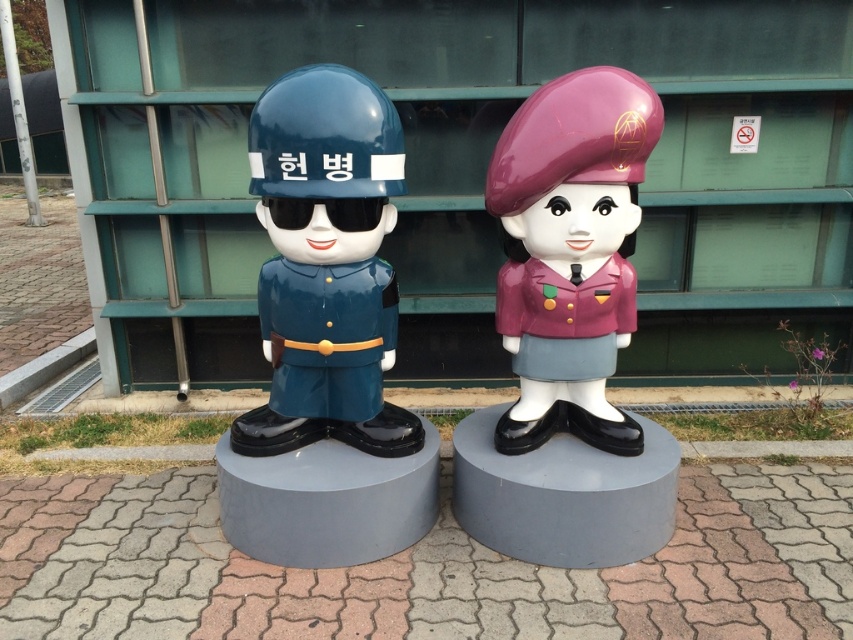
Question: Considering the relative positions of glossy blue helmet at center and purple glossy beret at center in the image provided, where is glossy blue helmet at center located with respect to purple glossy beret at center?

Choices:
 (A) left
 (B) right

Answer: (A)

Question: Which of the following is the farthest from the observer?

Choices:
 (A) (392, 406)
 (B) (521, 259)

Answer: (A)

Question: From the image, what is the correct spatial relationship of glossy blue helmet at center in relation to purple glossy beret at center?

Choices:
 (A) right
 (B) left

Answer: (B)

Question: Is glossy blue helmet at center bigger than purple glossy beret at center?

Choices:
 (A) no
 (B) yes

Answer: (B)

Question: Among these points, which one is nearest to the camera?

Choices:
 (A) (369, 342)
 (B) (534, 205)

Answer: (B)

Question: Which point appears closest to the camera in this image?

Choices:
 (A) (583, 184)
 (B) (308, 552)

Answer: (A)